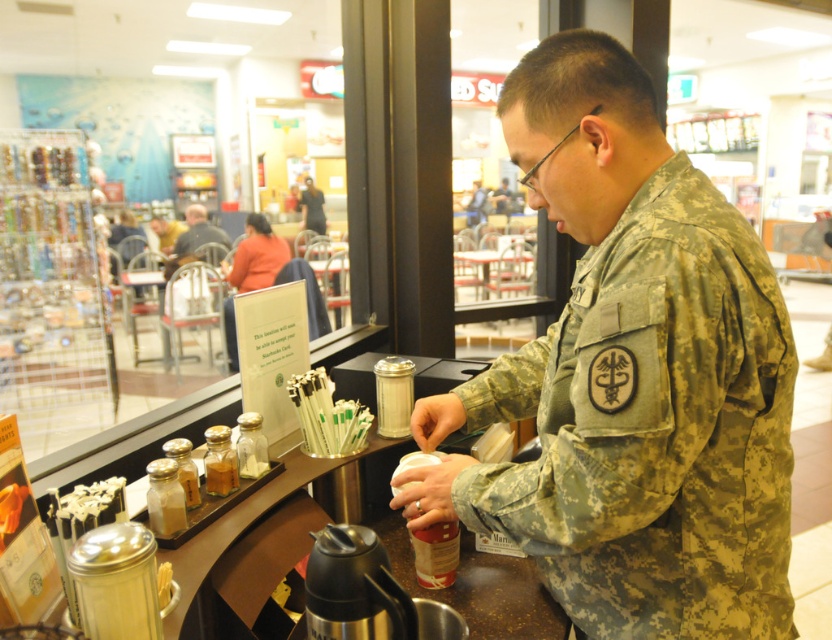
Does blurred skin at center appear under camouflage uniform at center?

Correct, blurred skin at center is located below camouflage uniform at center.

Between point (192, 227) and point (308, 184), which one is positioned in front?

Point (192, 227)

Locate an element on the screen. This screenshot has width=832, height=640. blurred skin at center is located at coordinates (197, 232).

Can you confirm if camouflage fabric uniform at center is bigger than blurred skin at center?

No.

Which is above, camouflage fabric uniform at center or blurred skin at center?

blurred skin at center is higher up.

Image resolution: width=832 pixels, height=640 pixels. I want to click on camouflage fabric uniform at center, so click(x=632, y=376).

Consider the image. Does camouflage fabric uniform at center have a smaller size compared to camouflage uniform at center?

Incorrect, camouflage fabric uniform at center is not smaller in size than camouflage uniform at center.

Can you confirm if camouflage fabric uniform at center is taller than camouflage uniform at center?

Yes.

This screenshot has height=640, width=832. In order to click on camouflage fabric uniform at center in this screenshot , I will do `click(632, 376)`.

This screenshot has height=640, width=832. What are the coordinates of `camouflage fabric uniform at center` in the screenshot? It's located at (632, 376).